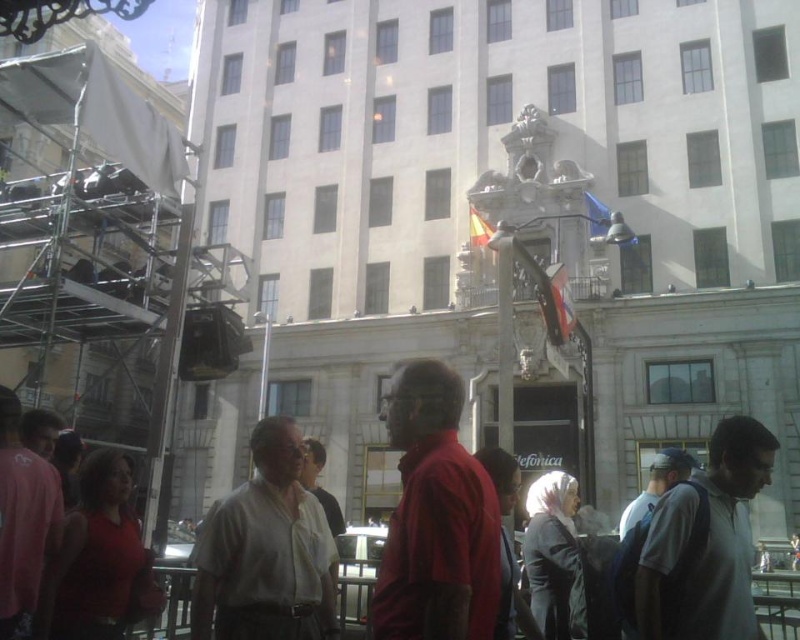
Question: Which object appears farthest from the camera in this image?

Choices:
 (A) gray fabric backpack at lower right
 (B) matte red shirt at center
 (C) light brown shirt at center

Answer: (C)

Question: Is the position of light brown shirt at center more distant than that of gray fabric backpack at lower right?

Choices:
 (A) yes
 (B) no

Answer: (A)

Question: Is the position of matte red shirt at center more distant than that of light brown shirt at center?

Choices:
 (A) yes
 (B) no

Answer: (B)

Question: Which point appears farthest from the camera in this image?

Choices:
 (A) (448, 500)
 (B) (666, 528)

Answer: (B)

Question: Is matte red shirt at center below gray fabric backpack at lower right?

Choices:
 (A) yes
 (B) no

Answer: (B)

Question: Which point is closer to the camera taking this photo?

Choices:
 (A) (377, 586)
 (B) (692, 620)
 (C) (248, 576)

Answer: (A)